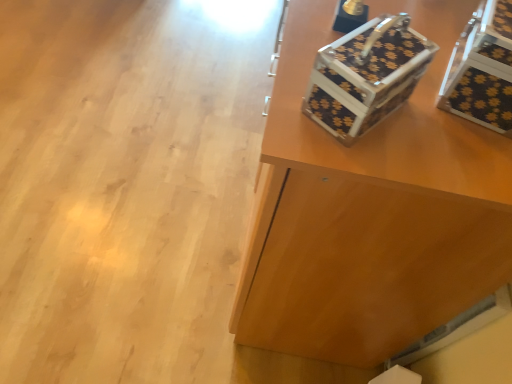
Find the location of a particular element. This screenshot has height=384, width=512. vacant space behind metallic floral-patterned shoe box at upper right is located at coordinates (347, 28).